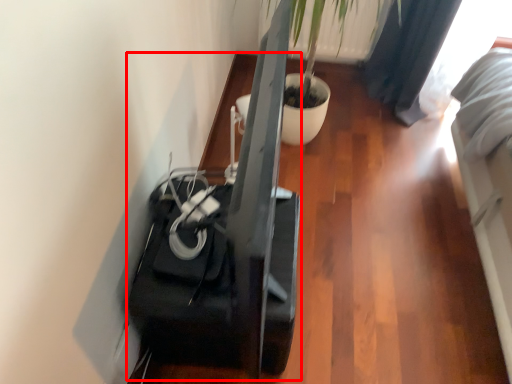
Question: From the image's perspective, considering the relative positions of furniture (annotated by the red box) and plant in the image provided, where is furniture (annotated by the red box) located with respect to the staircase?

Choices:
 (A) above
 (B) below

Answer: (B)